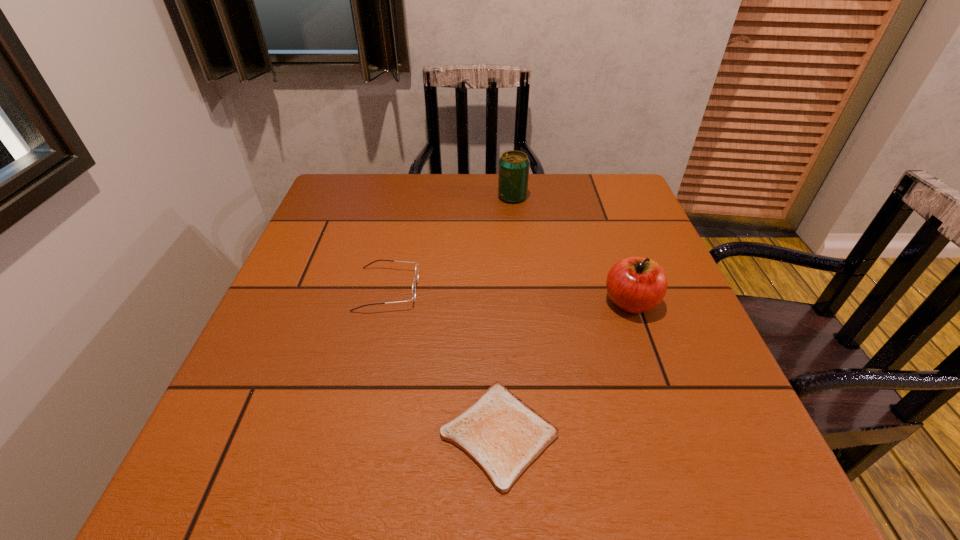
The height and width of the screenshot is (540, 960). I want to click on the farthest object, so click(513, 175).

Find the location of `apple`. apple is located at coordinates (635, 284).

This screenshot has width=960, height=540. I want to click on spectacles, so click(416, 268).

Find the location of a particular element. the leftmost object is located at coordinates (416, 268).

Locate an element on the screen. Image resolution: width=960 pixels, height=540 pixels. the nearest object is located at coordinates (503, 435).

Identify the location of the shortest object. (503, 435).

Locate an element on the screen. This screenshot has height=540, width=960. vacant space located 0.090m on the left of the beer can is located at coordinates (466, 197).

At what (x,y) coordinates should I click in order to perform the action: click on free space located 0.100m on the back of the rightmost object. Please return your answer as a coordinate pair (x, y). This screenshot has width=960, height=540. Looking at the image, I should click on (614, 256).

Locate an element on the screen. The image size is (960, 540). free location located through the lenses of the spectacles is located at coordinates (492, 289).

The width and height of the screenshot is (960, 540). Identify the location of vacant area located 0.210m on the right of the toast. (688, 434).